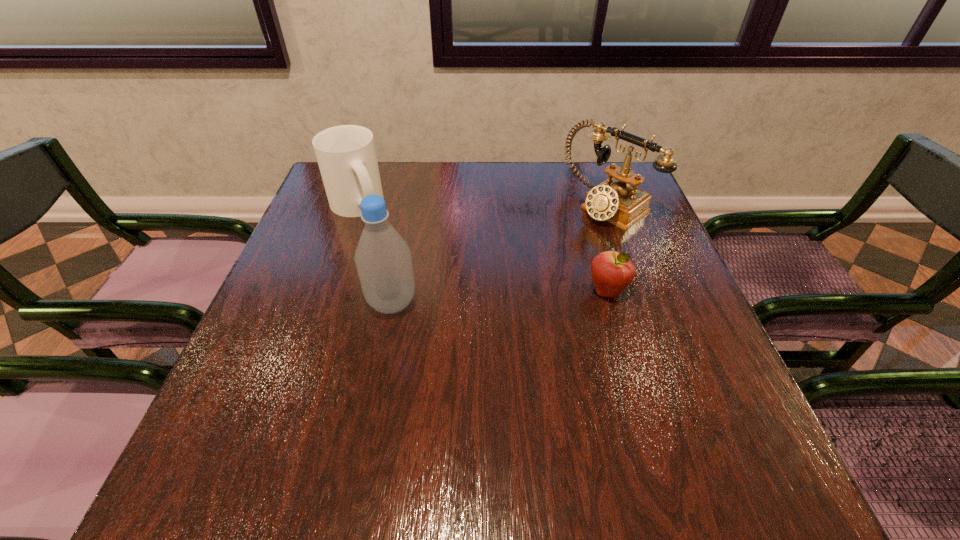
The width and height of the screenshot is (960, 540). I want to click on unoccupied area between the second shortest object and the shortest object, so click(482, 248).

Image resolution: width=960 pixels, height=540 pixels. I want to click on free point between the apple and the mug, so click(482, 248).

In order to click on empty location between the third tallest object and the shortest object in this screenshot , I will do `click(482, 248)`.

Where is `free spot between the third tallest object and the apple`? This screenshot has height=540, width=960. free spot between the third tallest object and the apple is located at coordinates (482, 248).

Identify which object is the closest to the second shortest object. Please provide its 2D coordinates. Your answer should be formatted as a tuple, i.e. [(x, y)], where the tuple contains the x and y coordinates of a point satisfying the conditions above.

[(383, 260)]

Identify which object is located as the second nearest to the leftmost object. Please provide its 2D coordinates. Your answer should be formatted as a tuple, i.e. [(x, y)], where the tuple contains the x and y coordinates of a point satisfying the conditions above.

[(614, 200)]

The height and width of the screenshot is (540, 960). I want to click on free region that satisfies the following two spatial constraints: 1. on the back side of the third object from right to left; 2. on the right side of the apple, so click(x=395, y=291).

Find the location of a particular element. Image resolution: width=960 pixels, height=540 pixels. free location that satisfies the following two spatial constraints: 1. on the back side of the telephone; 2. on the left side of the mug is located at coordinates (357, 204).